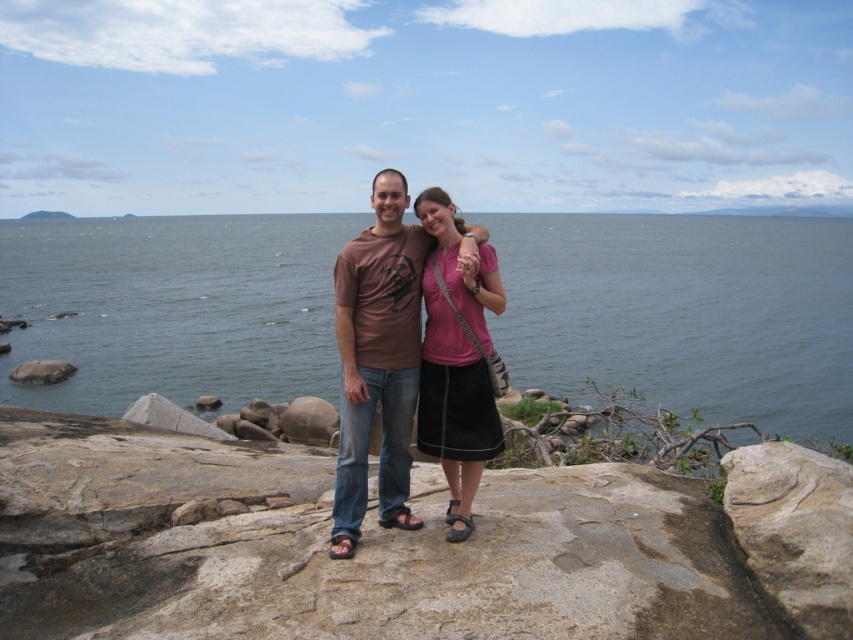
You are a photographer planning to capture a photo of the two people in the coastal scene. You want to ensure that both the brown rock at center and the pink fabric skirt at center are clearly visible. Given their sizes, which object might require you to adjust your camera focus more carefully?

The brown rock at center has a smaller size compared to the pink fabric skirt at center, so the brown rock at center might require more careful focus adjustment to ensure clarity in the photograph.